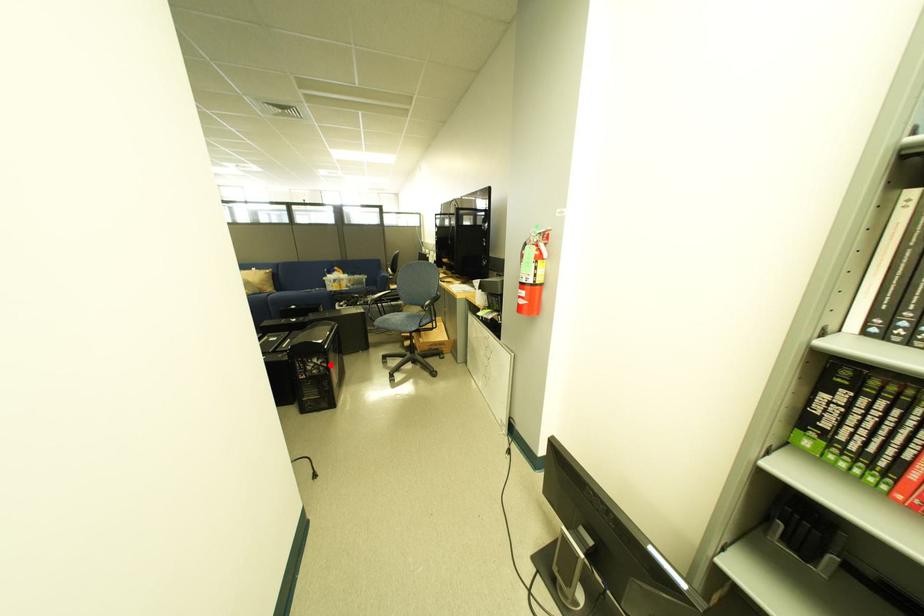
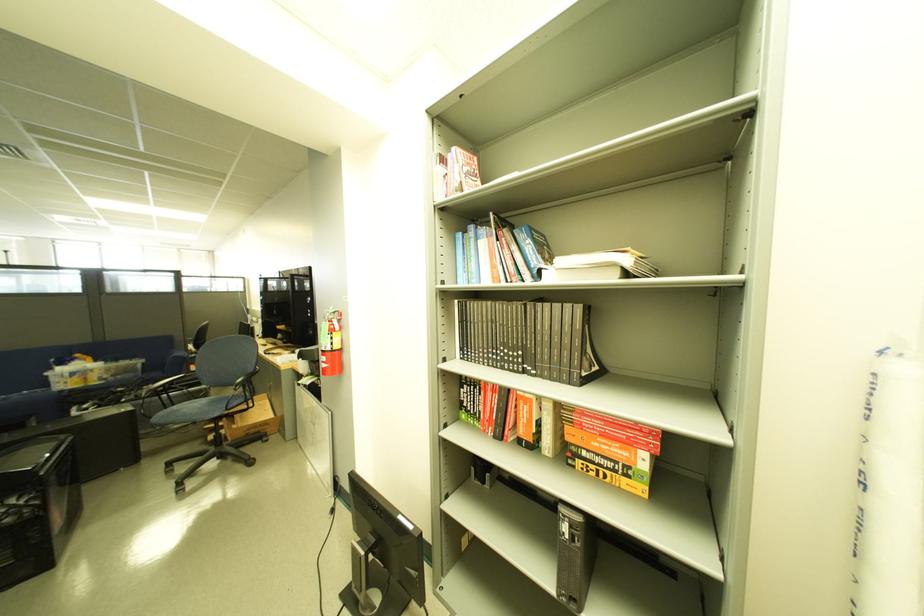
Where in the second image is the point corresponding to the highlighted location from the first image?

(33, 504)